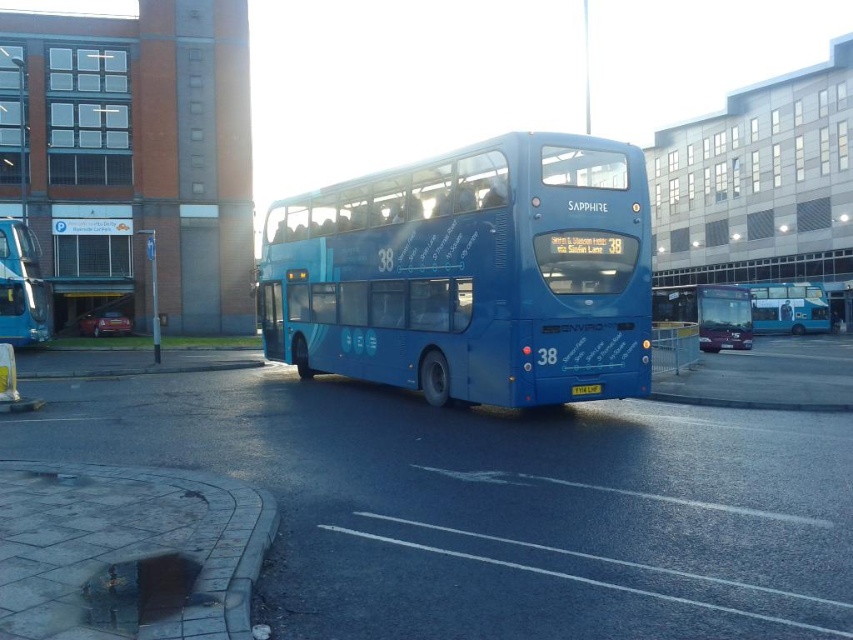
You are a delivery person who needs to move a 30 meter long cargo truck through the parking area. The truck requires a straight path of at least 30 meters to maneuver safely. Looking at the scene, can you determine if there is enough space between the matte blue bus at left and the matte blue bus at center to safely pass through with the cargo truck?

The distance between the matte blue bus at left and the matte blue bus at center is 28.37 meters, which is less than the required 30 meters. Therefore, the cargo truck cannot safely maneuver through this space.